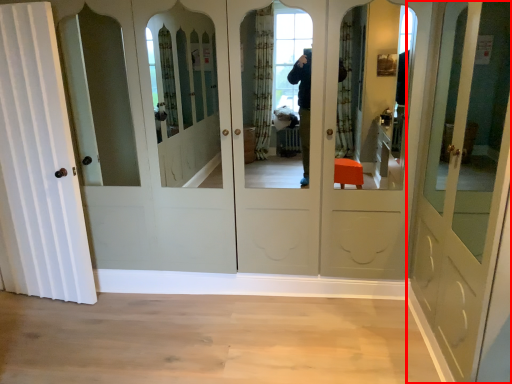
Question: From the image's perspective, considering the relative positions of door (annotated by the red box) and door in the image provided, where is door (annotated by the red box) located with respect to the staircase?

Choices:
 (A) below
 (B) above

Answer: (A)